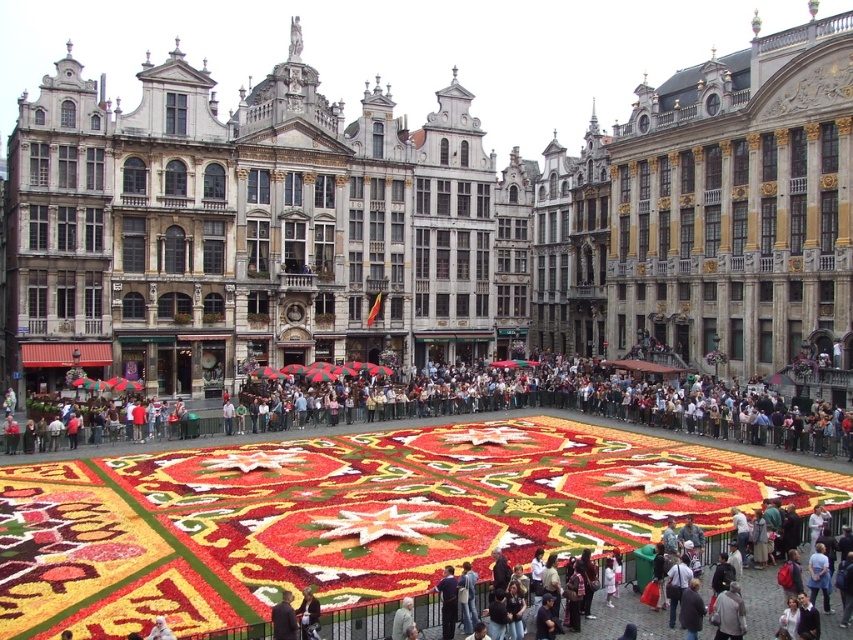
Question: Can you confirm if stone building at center is positioned below multicolored fabric crowd at center?

Choices:
 (A) yes
 (B) no

Answer: (B)

Question: Which of these objects is positioned farthest from the stone building at center?

Choices:
 (A) dark gray jacket at lower center
 (B) multicolored fabric crowd at center

Answer: (A)

Question: Is multicolored fabric crowd at center bigger than dark gray jacket at lower center?

Choices:
 (A) yes
 (B) no

Answer: (A)

Question: Which of the following is the closest to the observer?

Choices:
 (A) (851, 438)
 (B) (296, 625)

Answer: (B)

Question: Estimate the real-world distances between objects in this image. Which object is closer to the stone building at center?

Choices:
 (A) dark gray jacket at lower center
 (B) multicolored fabric crowd at center

Answer: (B)

Question: Does multicolored fabric crowd at center appear under dark gray jacket at lower center?

Choices:
 (A) no
 (B) yes

Answer: (A)